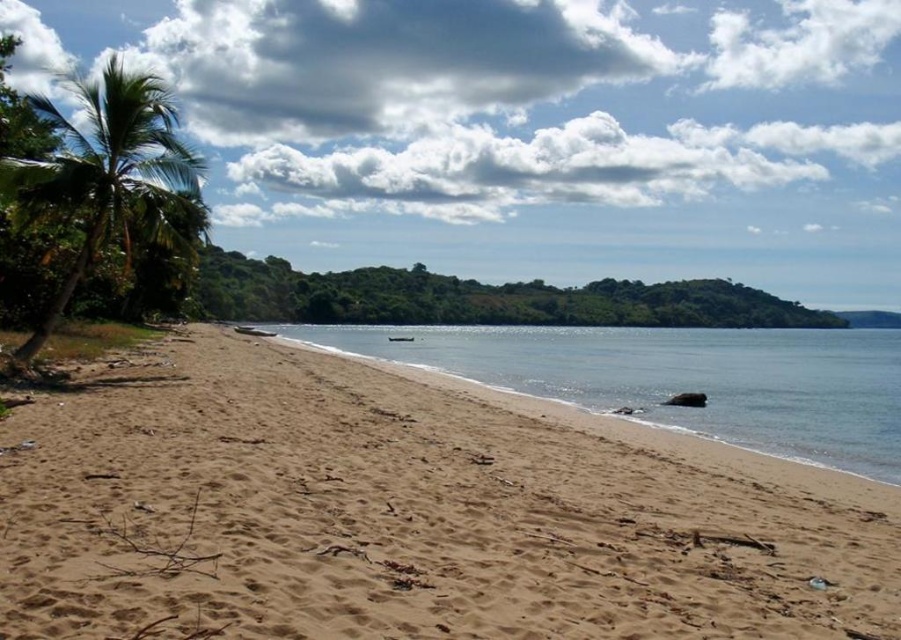
You are standing at the point labeled as point (410, 513) in the image. What is the immediate surface you are standing on?

The immediate surface at point (410, 513) is the sandy beach at lower left.

You are standing on the beach and want to take a photo of the clear blue water at center and the green leafy palm tree at left. Which object should you position to your left side to include both in the frame?

To include both the clear blue water at center and the green leafy palm tree at left in your photo, position the green leafy palm tree at left to your left side since it is located to the left of the clear blue water at center.

You are standing on the beach and want to take a photo of both the clear blue water at center and the green leafy palm tree at left. Since you want both to be fully visible in your photo, which object should you position closer to the edge of your camera frame to avoid cropping?

You should position the green leafy palm tree at left closer to the edge of your camera frame because the clear blue water at center is wider than the green leafy palm tree at left, making it more likely to fit within the frame without cropping.